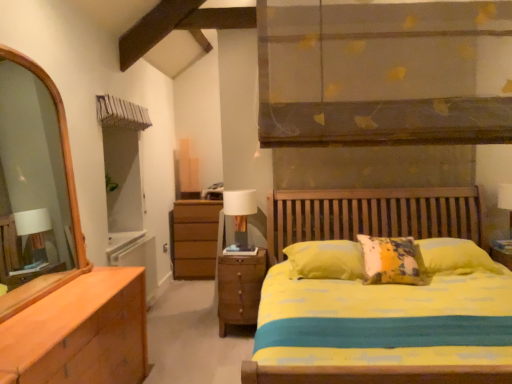
At what (x,y) coordinates should I click in order to perform the action: click on vacant space situated above wooden nightstand at lower center (from a real-world perspective). Please return your answer as a coordinate pair (x, y). Looking at the image, I should click on (242, 244).